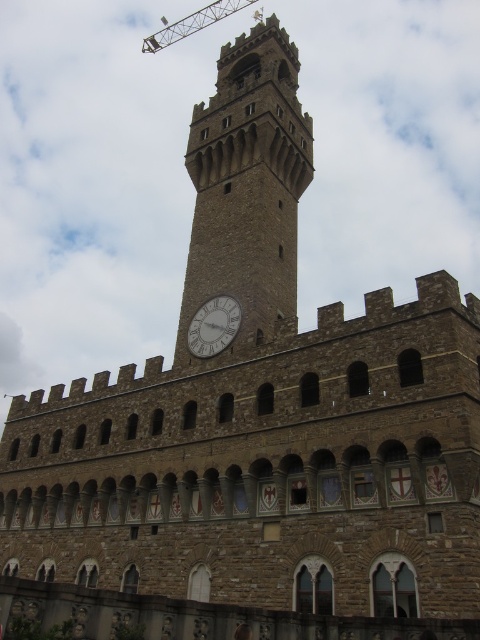
You are a construction worker planning to install a new clock face on the stone clock tower at center. The crane you have is the metallic construction crane at upper center. Can the crane fit through the narrowest part of the tower? Please explain based on their widths.

The stone clock tower at center is thinner than the metallic construction crane at upper center. Since the crane is wider than the narrowest part of the tower, it cannot fit through that area.

You are an architect inspecting the building. You notice the white stone clock at center and the metallic construction crane at upper center. Which object appears larger in the image?

The metallic construction crane at upper center appears larger than the white stone clock at center.

You are an architect designing a scale model of the historic building. You need to ensure the proportions between the stone clock tower at center and the white stone clock at center are accurate. Which one should you make wider in your model?

The stone clock tower at center should be made wider in the model since its width is larger than the white stone clock at center according to the description.